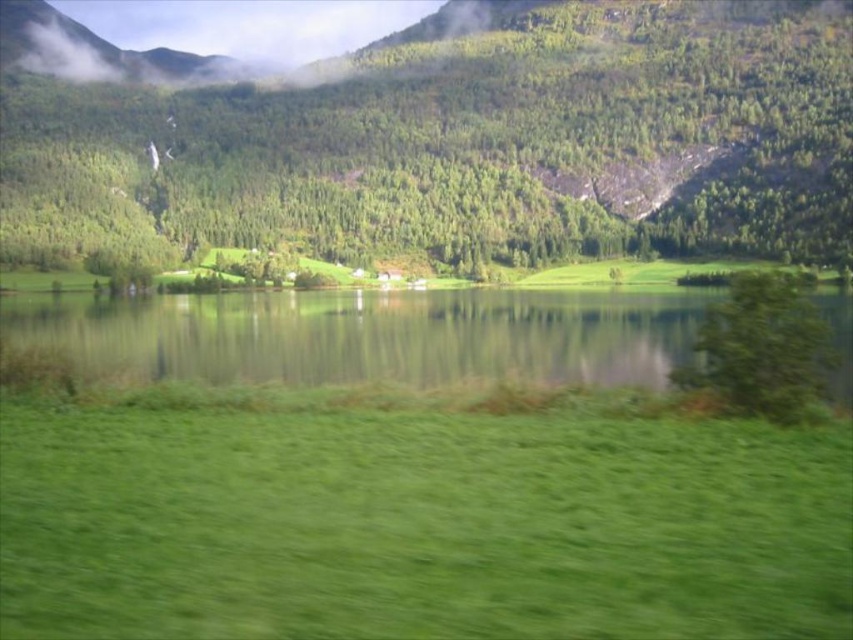
Is green grassy field at lower center positioned at the back of green leafy tree at right?

Yes, it is behind green leafy tree at right.

Between green grassy field at lower center and green leafy tree at right, which one is positioned lower?

green leafy tree at right is lower down.

Is point (288, 321) closer to viewer compared to point (735, 336)?

No, it is not.

Where is `green grassy field at lower center`? This screenshot has width=853, height=640. green grassy field at lower center is located at coordinates (368, 336).

Is green leafy tree at center below green leafy tree at right?

No, green leafy tree at center is not below green leafy tree at right.

Is point (843, 161) positioned after point (790, 276)?

Yes, it is behind point (790, 276).

Where is `green leafy tree at center`? This screenshot has height=640, width=853. green leafy tree at center is located at coordinates (463, 145).

Find the location of `green leafy tree at center`. green leafy tree at center is located at coordinates (463, 145).

Which of these two, green grass at lower center or green leafy tree at right, stands shorter?

Standing shorter between the two is green grass at lower center.

Is point (669, 560) less distant than point (706, 308)?

Yes, it is in front of point (706, 308).

You are a GUI agent. You are given a task and a screenshot of the screen. Output one action in this format:
    pyautogui.click(x=<x>, y=<y>)
    Task: Click on the green grass at lower center
    The width and height of the screenshot is (853, 640).
    Given the screenshot: What is the action you would take?
    pyautogui.click(x=419, y=525)